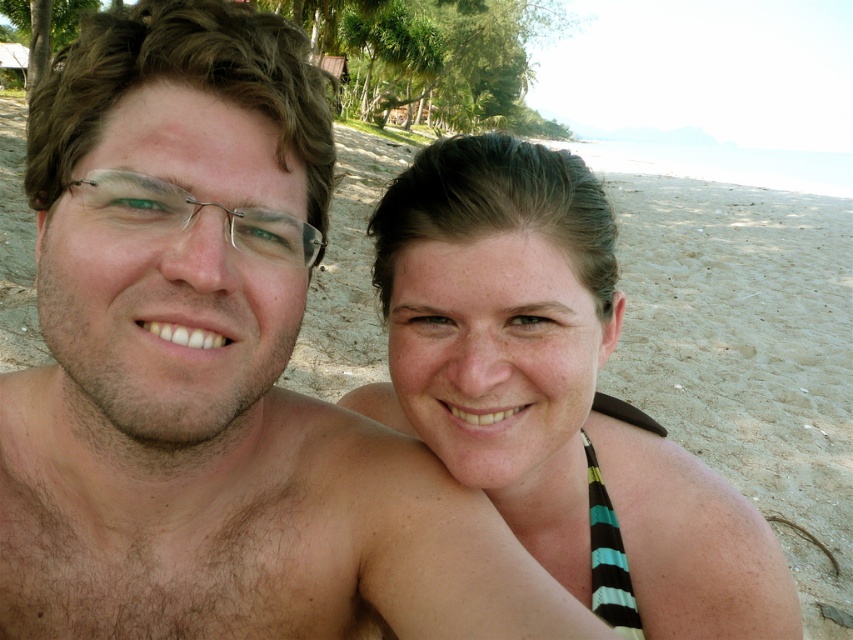
You are a photographer trying to capture a closeup shot of the metallic wire frame glasses at left without including the matte black bikini top at center in the frame. Is this possible given their positions?

The matte black bikini top at center is further to the viewer than metallic wire frame glasses at left, so the metallic wire frame glasses at left are behind the matte black bikini top at center. Therefore, it would be difficult to capture a closeup of the metallic wire frame glasses at left without the matte black bikini top at center blocking the view.

You are designing a layout for a beachwear catalog and need to place the matte black bikini top at center and the metallic wire frame glasses at left in the same photo. Which object should you position closer to the camera to maintain visual balance?

To maintain visual balance, the metallic wire frame glasses at left should be positioned closer to the camera since the matte black bikini top at center is larger and would appear smaller if placed farther away.